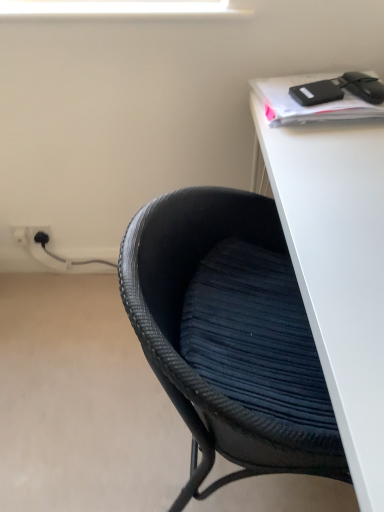
Question: Is black woven chair at lower left positioned far away from white plastic electric outlet at lower left, which ranks as the first electric outlet in left-to-right order?

Choices:
 (A) yes
 (B) no

Answer: (A)

Question: Is the position of black woven chair at lower left more distant than that of white plastic electric outlet at lower left, which ranks as the first electric outlet in left-to-right order?

Choices:
 (A) yes
 (B) no

Answer: (B)

Question: Would you say white plastic electric outlet at lower left, the 2th electric outlet when ordered from right to left, is part of black woven chair at lower left's contents?

Choices:
 (A) no
 (B) yes

Answer: (A)

Question: Does black woven chair at lower left appear on the left side of white plastic electric outlet at lower left, which ranks as the first electric outlet in left-to-right order?

Choices:
 (A) no
 (B) yes

Answer: (A)

Question: Can you see black woven chair at lower left touching white plastic electric outlet at lower left, which ranks as the first electric outlet in left-to-right order?

Choices:
 (A) yes
 (B) no

Answer: (B)

Question: From their relative heights in the image, would you say white plastic electric outlet at lower left, the 2th electric outlet when ordered from left to right, is taller or shorter than white plastic electric outlet at lower left, the 2th electric outlet when ordered from right to left?

Choices:
 (A) tall
 (B) short

Answer: (A)

Question: In terms of size, does white plastic electric outlet at lower left, the 2th electric outlet when ordered from left to right, appear bigger or smaller than white plastic electric outlet at lower left, the 2th electric outlet when ordered from right to left?

Choices:
 (A) big
 (B) small

Answer: (A)

Question: Is point (23, 230) closer or farther from the camera than point (16, 236)?

Choices:
 (A) closer
 (B) farther

Answer: (A)

Question: Looking at their shapes, would you say white plastic electric outlet at lower left, the 2th electric outlet when ordered from left to right, is wider or thinner than white plastic electric outlet at lower left, the 2th electric outlet when ordered from right to left?

Choices:
 (A) thin
 (B) wide

Answer: (A)

Question: Looking at their shapes, would you say white plastic electric outlet at lower left, the 2th electric outlet when ordered from right to left, is wider or thinner than black woven chair at lower left?

Choices:
 (A) thin
 (B) wide

Answer: (A)

Question: In terms of size, does white plastic electric outlet at lower left, the 2th electric outlet when ordered from right to left, appear bigger or smaller than black woven chair at lower left?

Choices:
 (A) big
 (B) small

Answer: (B)

Question: Is white plastic electric outlet at lower left, which ranks as the first electric outlet in left-to-right order, situated inside black woven chair at lower left or outside?

Choices:
 (A) inside
 (B) outside

Answer: (B)

Question: From a real-world perspective, is white plastic electric outlet at lower left, which ranks as the first electric outlet in left-to-right order, physically located above or below black woven chair at lower left?

Choices:
 (A) above
 (B) below

Answer: (B)

Question: Is white plastic electric outlet at lower left, the 2th electric outlet when ordered from left to right, inside the boundaries of white matte desk at upper right, or outside?

Choices:
 (A) inside
 (B) outside

Answer: (B)

Question: In terms of width, does white plastic electric outlet at lower left, the 2th electric outlet when ordered from left to right, look wider or thinner when compared to white matte desk at upper right?

Choices:
 (A) wide
 (B) thin

Answer: (B)